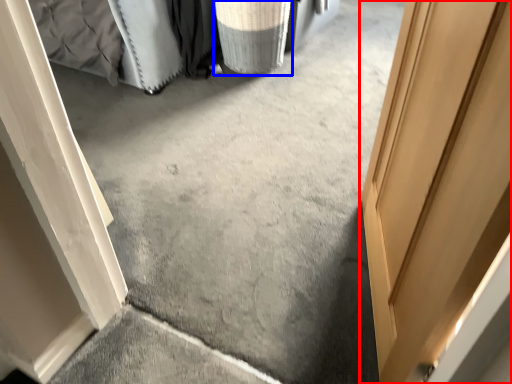
Question: Which point is closer to the camera, door (highlighted by a red box) or laundry basket (highlighted by a blue box)?

Choices:
 (A) door
 (B) laundry basket

Answer: (A)